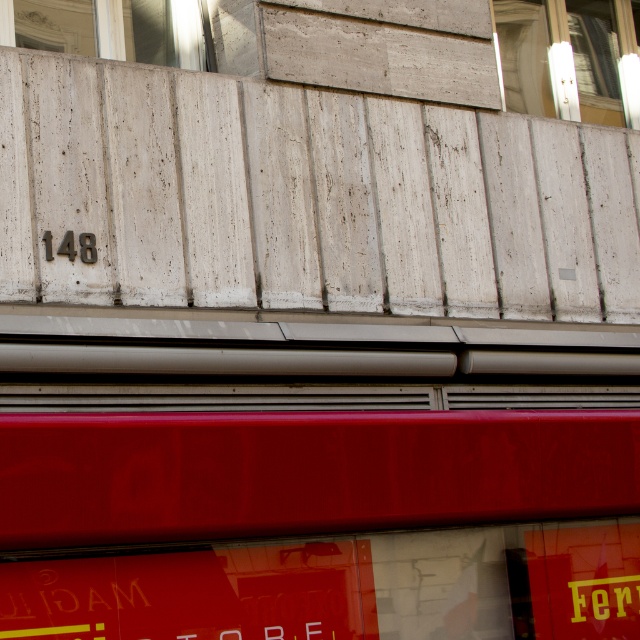
Is clear glass window at upper right to the right of white marble window at upper left from the viewer's perspective?

Indeed, clear glass window at upper right is positioned on the right side of white marble window at upper left.

Which is above, clear glass window at upper right or white marble window at upper left?

Positioned higher is clear glass window at upper right.

Who is more distant from viewer, (582, 76) or (186, 10)?

The point (582, 76) is more distant.

Where is `clear glass window at upper right`? clear glass window at upper right is located at coordinates (561, 58).